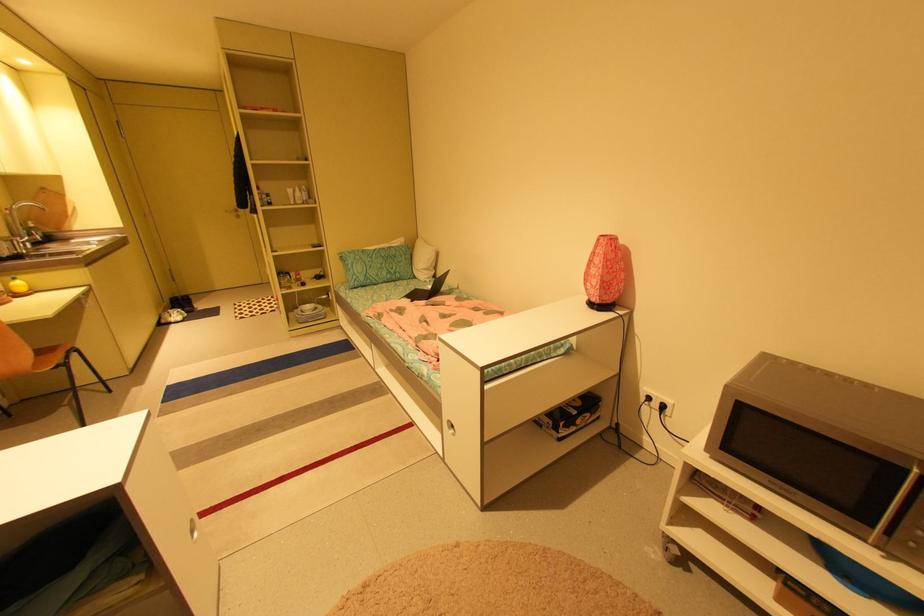
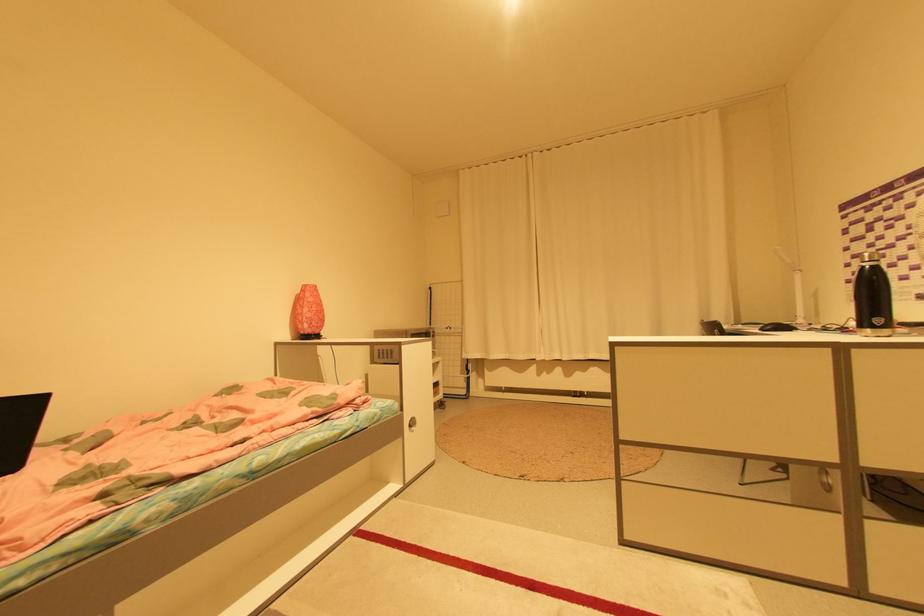
Where in the second image is the point corresponding to point 608,236 from the first image?

(311, 285)